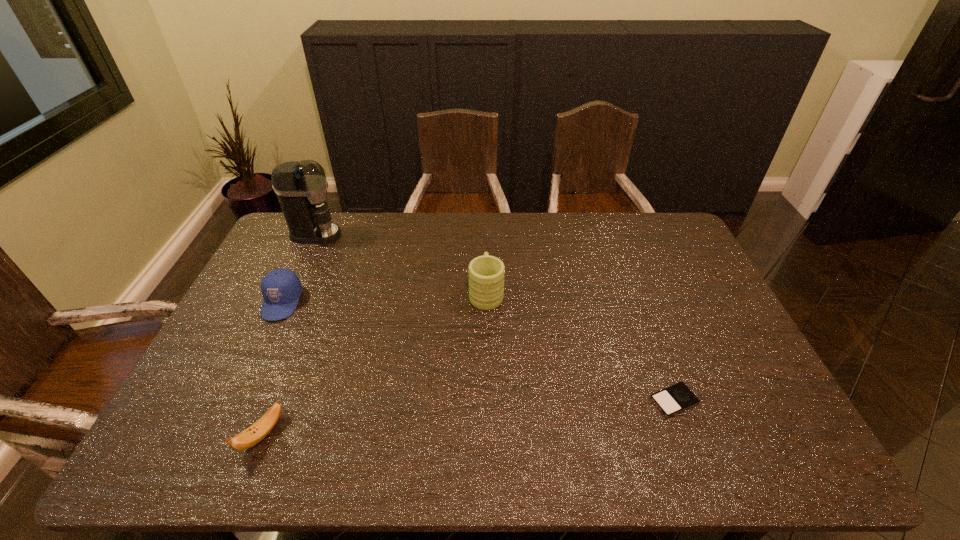
Locate an element on the screen. vacant space that satisfies the following two spatial constraints: 1. on the side of the mug with the handle; 2. place cup under the spout of the coffee maker is located at coordinates (485, 234).

In order to click on free location that satisfies the following two spatial constraints: 1. place cup under the spout of the fourth tallest object; 2. on the left side of the farthest object in this screenshot , I will do `click(223, 434)`.

Where is `vacant space that satisfies the following two spatial constraints: 1. place cup under the spout of the tallest object; 2. on the front-facing side of the cap`? vacant space that satisfies the following two spatial constraints: 1. place cup under the spout of the tallest object; 2. on the front-facing side of the cap is located at coordinates pyautogui.click(x=284, y=302).

In order to click on vacant space that satisfies the following two spatial constraints: 1. place cup under the spout of the tallest object; 2. on the back side of the fourth tallest object in this screenshot , I will do point(223,434).

Find the location of `blank area in the image that satisfies the following two spatial constraints: 1. on the front-facing side of the iPod; 2. on the right side of the cap`. blank area in the image that satisfies the following two spatial constraints: 1. on the front-facing side of the iPod; 2. on the right side of the cap is located at coordinates (236, 401).